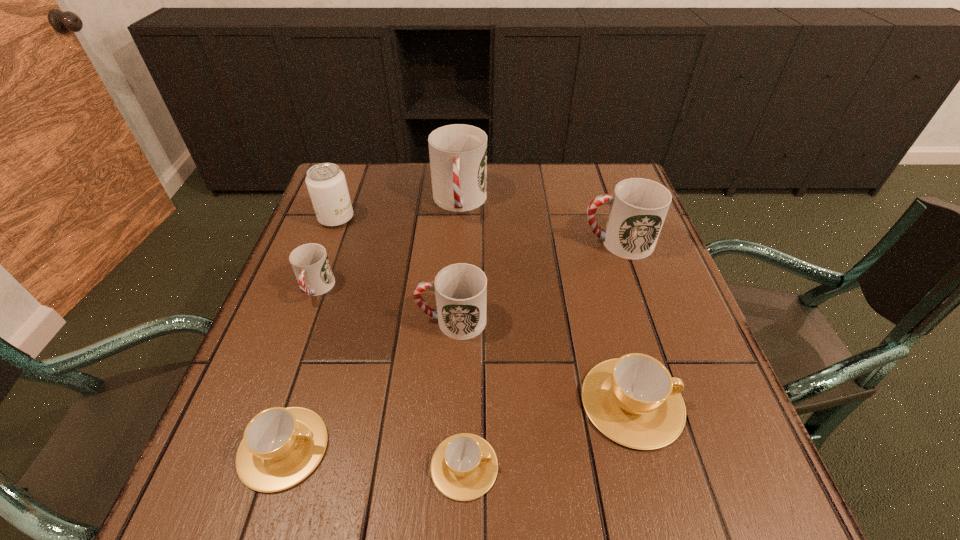
This screenshot has height=540, width=960. I want to click on the biggest red cup, so click(458, 153).

At what (x,y) coordinates should I click in order to perform the action: click on the tallest object. Please return your answer as a coordinate pair (x, y). Looking at the image, I should click on (458, 153).

Find the location of a particular element. The width and height of the screenshot is (960, 540). the second tallest cup is located at coordinates (639, 206).

Image resolution: width=960 pixels, height=540 pixels. In order to click on the rightmost red cup in this screenshot , I will do `click(639, 206)`.

Find the location of a particular element. The width and height of the screenshot is (960, 540). soda can is located at coordinates (326, 183).

Find the location of a particular element. The width and height of the screenshot is (960, 540). the third tallest cup is located at coordinates (460, 289).

At what (x,y) coordinates should I click in order to perform the action: click on the fifth shortest object. Please return your answer as a coordinate pair (x, y). The width and height of the screenshot is (960, 540). Looking at the image, I should click on (460, 289).

This screenshot has width=960, height=540. I want to click on the smallest red cup, so click(310, 263).

The height and width of the screenshot is (540, 960). I want to click on the rightmost brown cup, so click(x=633, y=400).

At what (x,y) coordinates should I click in order to perform the action: click on the sixth tallest cup. Please return your answer as a coordinate pair (x, y). The width and height of the screenshot is (960, 540). Looking at the image, I should click on (281, 446).